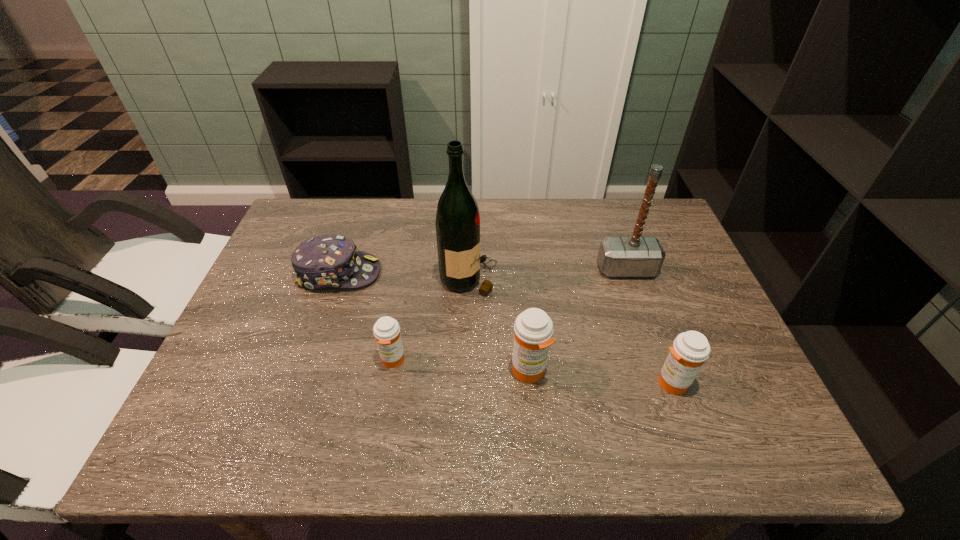
Find the location of a particular element. free spot located on the front of the second shortest object is located at coordinates (387, 396).

Where is `vacant space located on the right of the second medicine from right to left`? The height and width of the screenshot is (540, 960). vacant space located on the right of the second medicine from right to left is located at coordinates (695, 371).

The height and width of the screenshot is (540, 960). What are the coordinates of `vacant space located 0.100m on the back of the rightmost medicine` in the screenshot? It's located at (654, 334).

Where is `free space located 0.090m on the front-facing side of the leftmost object`? This screenshot has height=540, width=960. free space located 0.090m on the front-facing side of the leftmost object is located at coordinates (413, 273).

What are the coordinates of `vacant space located 0.160m on the surface of the fourth object from right to left` in the screenshot? It's located at (557, 278).

At what (x,y) coordinates should I click in order to perform the action: click on free space located 0.260m on the striking surface of the hammer. Please return your answer as a coordinate pair (x, y). Looking at the image, I should click on (659, 360).

The width and height of the screenshot is (960, 540). Identify the location of object present at the left edge. (328, 261).

In order to click on medicine that is at the right edge in this screenshot , I will do `click(690, 349)`.

The height and width of the screenshot is (540, 960). Identify the location of hammer positioned at the right edge. (636, 256).

Where is `object at the near right corner`? This screenshot has height=540, width=960. object at the near right corner is located at coordinates (690, 349).